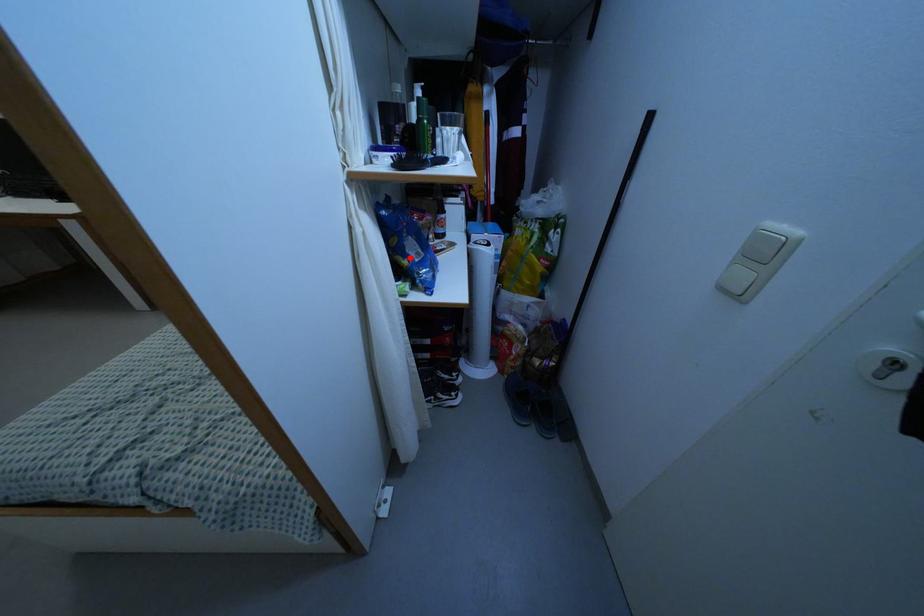
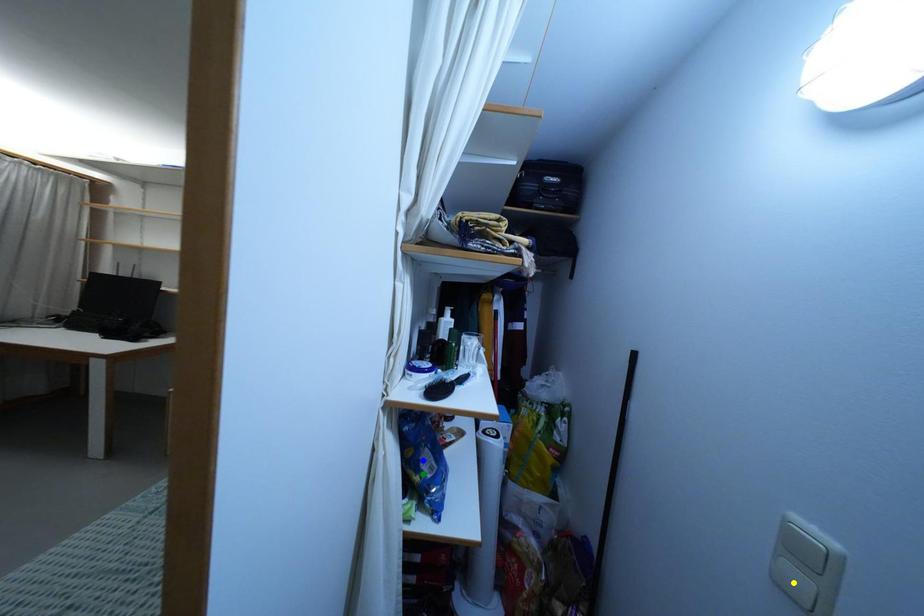
Question: I am providing you with two images of the same scene from different viewpoints. A red point is marked on the first image. You are given multiple points on the second image. In image 2, which mark is for the same physical point as the one in image 1?

Choices:
 (A) yellow point
 (B) blue point
 (C) green point

Answer: (C)